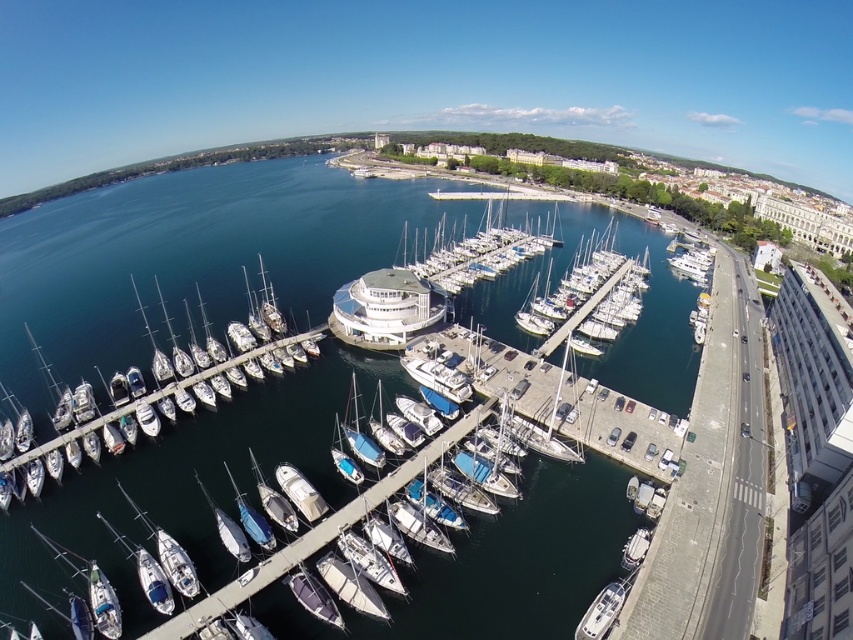
Question: Can you confirm if dark blue water at center is positioned to the right of white glossy sailboat at lower center?

Choices:
 (A) no
 (B) yes

Answer: (B)

Question: Does dark blue water at center appear under white glossy sailboat at lower center?

Choices:
 (A) yes
 (B) no

Answer: (B)

Question: Is dark blue water at center further to the viewer compared to white glossy sailboat at lower center?

Choices:
 (A) yes
 (B) no

Answer: (B)